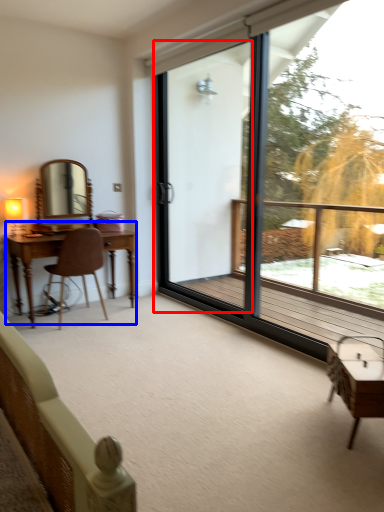
Question: Which object appears farthest to the camera in this image, screen door (highlighted by a red box) or table (highlighted by a blue box)?

Choices:
 (A) screen door
 (B) table

Answer: (B)